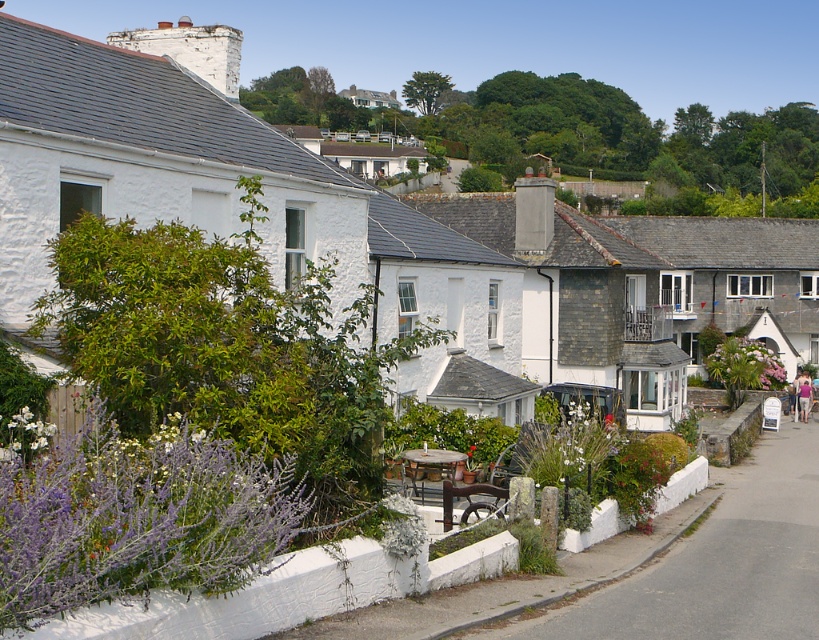
Which is behind, point (0, 305) or point (618, 336)?

Positioned behind is point (618, 336).

Who is more forward, (84, 68) or (650, 378)?

Point (84, 68)

Which is behind, point (25, 256) or point (566, 339)?

The point (566, 339) is more distant.

Locate an element on the screen. This screenshot has height=640, width=819. white stucco cottage at upper left is located at coordinates (152, 154).

Describe the element at coordinates (735, 280) in the screenshot. I see `gray slate roofed cottage at center` at that location.

Between point (718, 278) and point (799, 406), which one is positioned behind?

The point (718, 278) is behind.

The image size is (819, 640). What are the coordinates of `gray slate roofed cottage at center` in the screenshot? It's located at (735, 280).

Measure the distance between point (64, 212) and camera.

Point (64, 212) is 18.92 meters away from camera.

Who is lower down, white stucco cottage at upper left or pink fabric at lower right?

Positioned lower is pink fabric at lower right.

Locate an element on the screen. This screenshot has height=640, width=819. white stucco cottage at upper left is located at coordinates (152, 154).